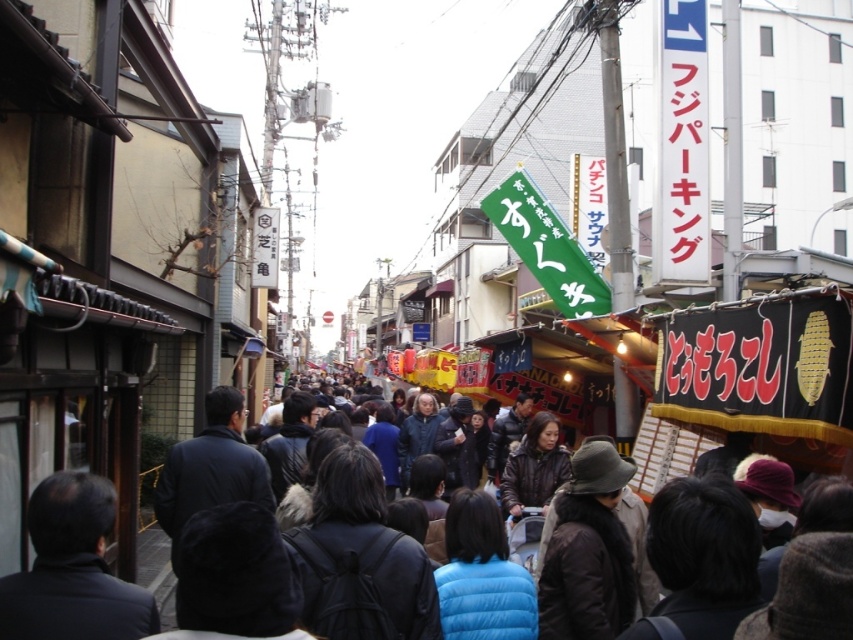
Question: Does white plastic sign at upper right have a lesser width compared to dark brown leather jacket at center?

Choices:
 (A) no
 (B) yes

Answer: (B)

Question: Can you confirm if white plastic sign at upper right is positioned below dark brown leather jacket at center?

Choices:
 (A) yes
 (B) no

Answer: (B)

Question: Can you confirm if white plastic sign at upper right is smaller than dark brown leather jacket at center?

Choices:
 (A) yes
 (B) no

Answer: (A)

Question: Which point appears farthest from the camera in this image?

Choices:
 (A) (686, 141)
 (B) (146, 540)

Answer: (B)